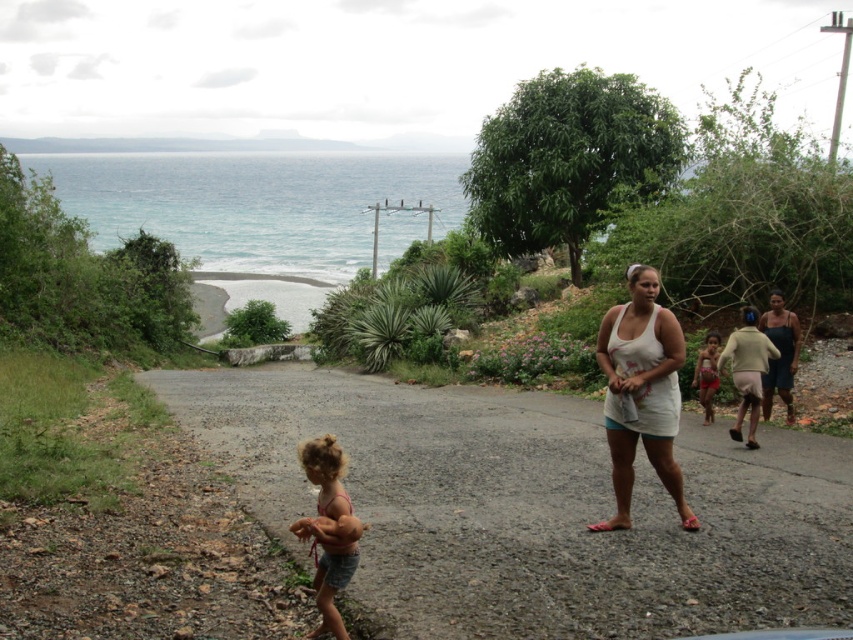
You are a photographer trying to capture the child in the scene. The child is wearing a white cotton tank top at center and red fabric shorts at center. Which piece of clothing is wider?

The white cotton tank top at center is wider than the red fabric shorts at center.

You are a photographer trying to capture a candid shot of the two clothing items mentioned. Since you want to ensure both the white cotton tank top at center and the red fabric shorts at center are visible in the frame, which one should you focus on first to make sure they are both in the shot?

The white cotton tank top at center is positioned on the left side of red fabric shorts at center, so focusing on the white cotton tank top at center first will ensure both are in the frame as you adjust the camera angle to include the red fabric shorts at center on the right.

In the scene shown: You are a photographer standing at the lower left of the scene. You want to take a photo of the curly blonde hair at lower left and the red fabric shorts at center. Can you fit both subjects into your camera frame if your camera has a 20 feet wide field of view?

The distance between the curly blonde hair at lower left and the red fabric shorts at center is 27.00 feet. Since the camera has a 20 feet wide field of view, which is narrower than the distance between the two subjects, you cannot fit both into the frame.